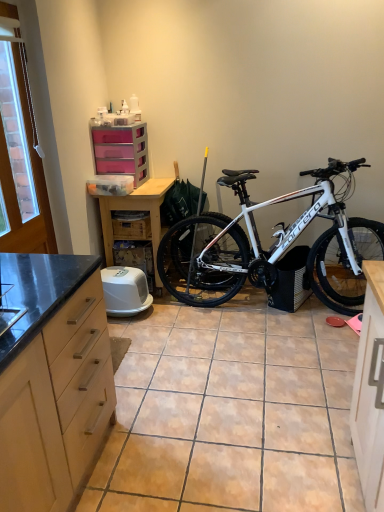
Question: From the image's perspective, would you say white plastic chain at upper left is shown under wooden crate at center?

Choices:
 (A) yes
 (B) no

Answer: (B)

Question: Is white plastic chain at upper left smaller than wooden crate at center?

Choices:
 (A) no
 (B) yes

Answer: (B)

Question: Does white plastic chain at upper left have a greater width compared to wooden crate at center?

Choices:
 (A) no
 (B) yes

Answer: (A)

Question: Is white plastic chain at upper left positioned with its back to wooden crate at center?

Choices:
 (A) yes
 (B) no

Answer: (B)

Question: From a real-world perspective, is white plastic chain at upper left physically above wooden crate at center?

Choices:
 (A) no
 (B) yes

Answer: (B)

Question: In terms of width, does white plastic chain at upper left look wider or thinner when compared to pink plastic chest of drawers at upper center?

Choices:
 (A) wide
 (B) thin

Answer: (B)

Question: Is white plastic chain at upper left inside or outside of pink plastic chest of drawers at upper center?

Choices:
 (A) outside
 (B) inside

Answer: (A)

Question: Is point (29, 214) positioned closer to the camera than point (139, 155)?

Choices:
 (A) farther
 (B) closer

Answer: (B)

Question: Would you say white plastic chain at upper left is to the left or to the right of pink plastic chest of drawers at upper center in the picture?

Choices:
 (A) left
 (B) right

Answer: (A)

Question: Is point (339, 302) positioned closer to the camera than point (117, 266)?

Choices:
 (A) farther
 (B) closer

Answer: (B)

Question: From a real-world perspective, is white matte bicycle at center-right physically located above or below white plastic litter box at center?

Choices:
 (A) below
 (B) above

Answer: (B)

Question: Is white matte bicycle at center-right wider or thinner than white plastic litter box at center?

Choices:
 (A) thin
 (B) wide

Answer: (B)

Question: Would you say white matte bicycle at center-right is inside or outside white plastic litter box at center?

Choices:
 (A) outside
 (B) inside

Answer: (A)

Question: From a real-world perspective, is wooden crate at center above or below white plastic litter box at center?

Choices:
 (A) above
 (B) below

Answer: (A)

Question: Is wooden crate at center bigger or smaller than white plastic litter box at center?

Choices:
 (A) small
 (B) big

Answer: (A)